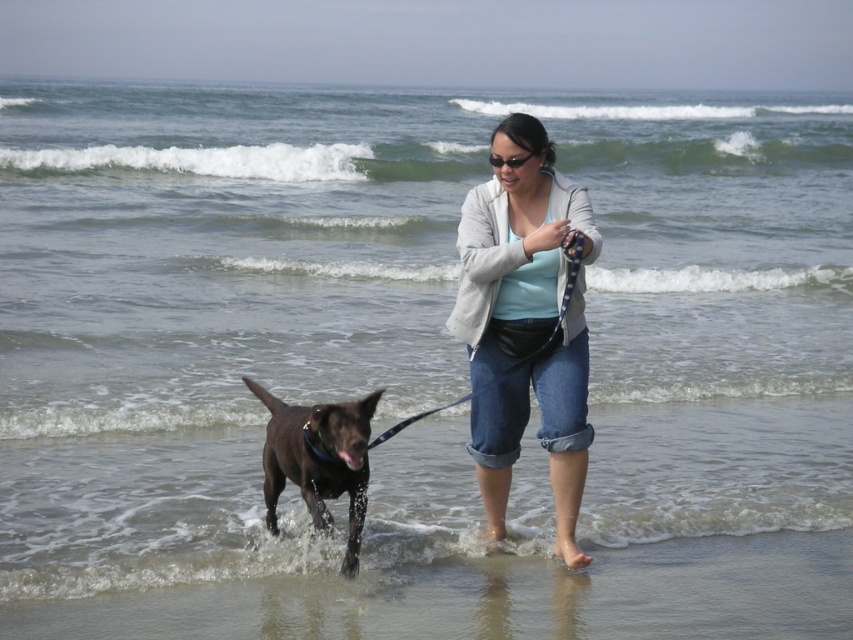
You are standing on the sandy beach at lower center and want to retrieve the blue fabric leash at center. Which direction should you move to reach it?

Since the sandy beach at lower center is to the right of the blue fabric leash at center, you should move to your left to reach it.

You are standing at the point marked by coordinates point (497, 596). Which object from the scene are you currently standing on?

The sandy beach at lower center is represented by point (497, 596), so you are standing on the sandy beach at lower center.

You are a photographer trying to capture the woman and her dog on the beach. You want to ensure the sandy beach at lower center and the blue fabric leash at center are both visible in the frame. Considering their heights, which object should you focus on to ensure both are in focus?

The sandy beach at lower center has a greater height compared to the blue fabric leash at center. To ensure both are in focus, you should focus on the sandy beach at lower center since it is taller and will require the lens to adjust to a longer distance, allowing the shorter blue fabric leash at center to remain in focus as well.